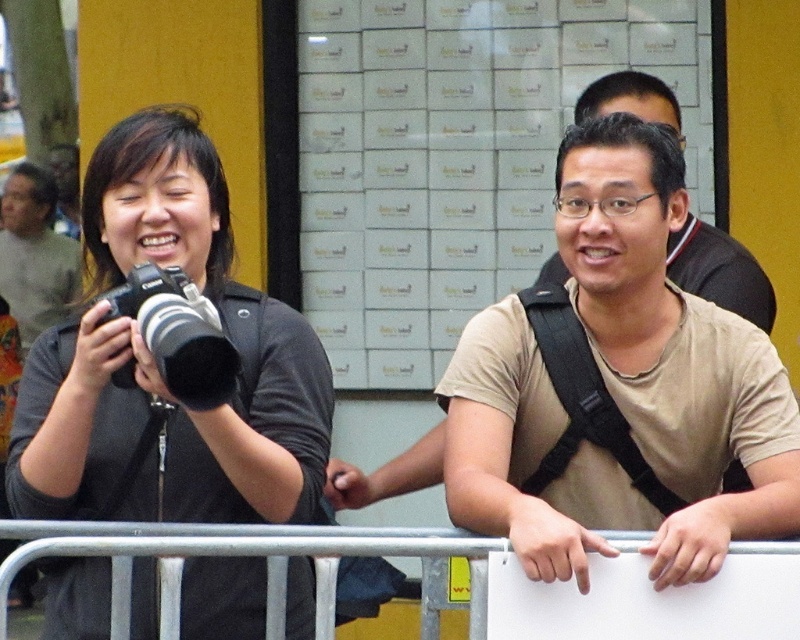
The image size is (800, 640). In order to click on metal at center in this screenshot , I will do `click(229, 540)`.

Who is shorter, metal at center or black matte camera at left?

metal at center

Which is in front, point (754, 541) or point (214, 376)?

Point (214, 376)

Find the location of `metal at center`. metal at center is located at coordinates tap(229, 540).

Can you confirm if matte black camera at left is positioned to the right of metal at center?

In fact, matte black camera at left is to the left of metal at center.

Does matte black camera at left come in front of metal at center?

No.

Is point (210, 576) behind point (66, 531)?

Yes, point (210, 576) is behind point (66, 531).

At what (x,y) coordinates should I click in order to perform the action: click on matte black camera at left. Please return your answer as a coordinate pair (x, y). The width and height of the screenshot is (800, 640). Looking at the image, I should click on (154, 365).

Is tan cotton t-shirt at center closer to camera compared to gray sweater at left?

Yes, it is.

Does tan cotton t-shirt at center appear on the right side of gray sweater at left?

Correct, you'll find tan cotton t-shirt at center to the right of gray sweater at left.

Where is `tan cotton t-shirt at center`? tan cotton t-shirt at center is located at coordinates (622, 387).

Identify the location of tan cotton t-shirt at center. [622, 387].